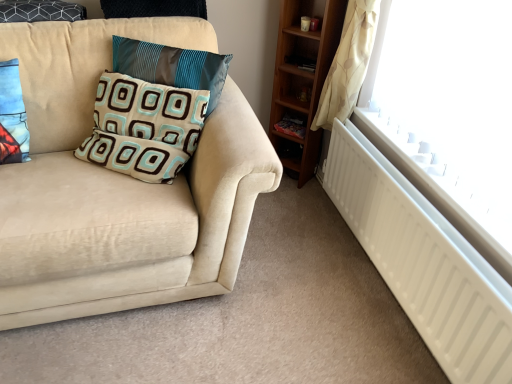
Question: Is teal satin pillow at upper left, arranged as the first pillow when viewed from the right, to the right of wooden shelf at lower right from the viewer's perspective?

Choices:
 (A) no
 (B) yes

Answer: (A)

Question: From the image's perspective, is teal satin pillow at upper left, arranged as the first pillow when viewed from the right, located above wooden shelf at lower right?

Choices:
 (A) no
 (B) yes

Answer: (B)

Question: From the image's perspective, would you say teal satin pillow at upper left, arranged as the first pillow when viewed from the right, is shown under wooden shelf at lower right?

Choices:
 (A) yes
 (B) no

Answer: (B)

Question: Would you say teal satin pillow at upper left, arranged as the first pillow when viewed from the right, is outside wooden shelf at lower right?

Choices:
 (A) no
 (B) yes

Answer: (B)

Question: Is teal satin pillow at upper left, arranged as the first pillow when viewed from the right, far away from wooden shelf at lower right?

Choices:
 (A) yes
 (B) no

Answer: (B)

Question: Is patterned fabric pillow at center, acting as the 2th pillow starting from the right, inside or outside of white matte radiator at lower right?

Choices:
 (A) outside
 (B) inside

Answer: (A)

Question: In terms of height, does patterned fabric pillow at center, acting as the 2th pillow starting from the right, look taller or shorter compared to white matte radiator at lower right?

Choices:
 (A) short
 (B) tall

Answer: (A)

Question: Does point (117, 155) appear closer or farther from the camera than point (353, 226)?

Choices:
 (A) closer
 (B) farther

Answer: (A)

Question: Considering the positions of patterned fabric pillow at center, marked as the second pillow in a left-to-right arrangement, and white matte radiator at lower right in the image, is patterned fabric pillow at center, marked as the second pillow in a left-to-right arrangement, bigger or smaller than white matte radiator at lower right?

Choices:
 (A) small
 (B) big

Answer: (A)

Question: Is suede beige couch at left inside the boundaries of wooden shelf at lower right, or outside?

Choices:
 (A) inside
 (B) outside

Answer: (B)

Question: From the image's perspective, is suede beige couch at left located above or below wooden shelf at lower right?

Choices:
 (A) below
 (B) above

Answer: (A)

Question: In terms of height, does suede beige couch at left look taller or shorter compared to wooden shelf at lower right?

Choices:
 (A) short
 (B) tall

Answer: (B)

Question: Based on their positions, is suede beige couch at left located to the left or right of wooden shelf at lower right?

Choices:
 (A) right
 (B) left

Answer: (B)

Question: Based on their sizes in the image, would you say wooden shelf at lower right is bigger or smaller than blue fabric pillow at left, the 1th pillow when ordered from left to right?

Choices:
 (A) big
 (B) small

Answer: (B)

Question: Is wooden shelf at lower right to the left or to the right of blue fabric pillow at left, acting as the third pillow starting from the right, in the image?

Choices:
 (A) left
 (B) right

Answer: (B)